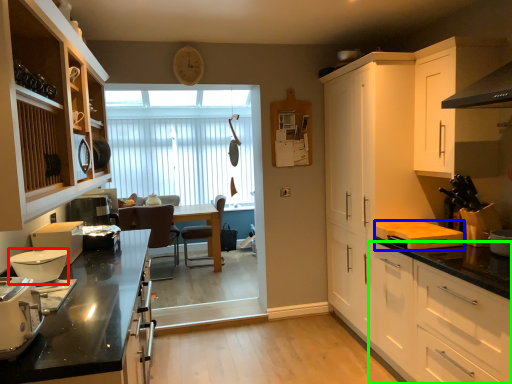
Question: Which is farther away from kitchen appliance (highlighted by a red box)? appliance (highlighted by a blue box) or cabinetry (highlighted by a green box)?

Choices:
 (A) appliance
 (B) cabinetry

Answer: (A)